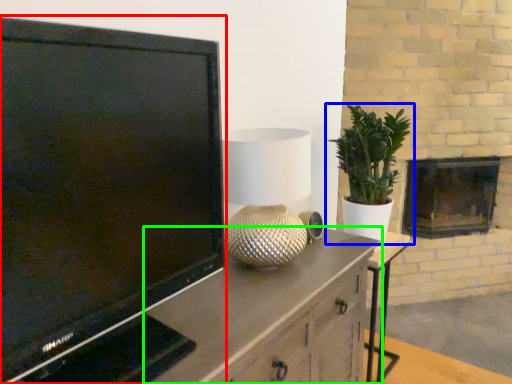
Question: Considering the real-world distances, which object is farthest from television (highlighted by a red box)? houseplant (highlighted by a blue box) or cabinetry (highlighted by a green box)?

Choices:
 (A) houseplant
 (B) cabinetry

Answer: (A)